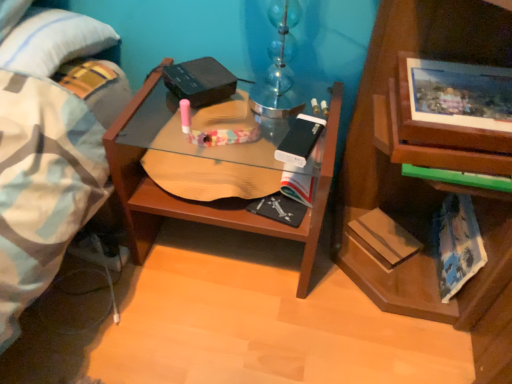
Question: Based on their sizes in the image, would you say hardcover book at lower right, which is the 2th paperback book in right-to-left order, is bigger or smaller than blue tie-dye paperback book at lower right, which appears as the third paperback book when viewed from the left?

Choices:
 (A) big
 (B) small

Answer: (B)

Question: Is point (364, 221) closer or farther from the camera than point (457, 225)?

Choices:
 (A) farther
 (B) closer

Answer: (A)

Question: Which of these objects is positioned farthest from the blue tie-dye paperback book at lower right, which appears as the 1th paperback book when viewed from the right?

Choices:
 (A) hardcover book at lower right, the second paperback book in the left-to-right sequence
 (B) white matte paperback book at center, the first paperback book viewed from the left
 (C) wooden desk at center

Answer: (C)

Question: Based on their relative distances, which object is farther from the blue tie-dye paperback book at lower right, which appears as the 1th paperback book when viewed from the right?

Choices:
 (A) wooden desk at center
 (B) white matte paperback book at center, acting as the 3th paperback book starting from the right
 (C) hardcover book at lower right, the second paperback book in the left-to-right sequence

Answer: (A)